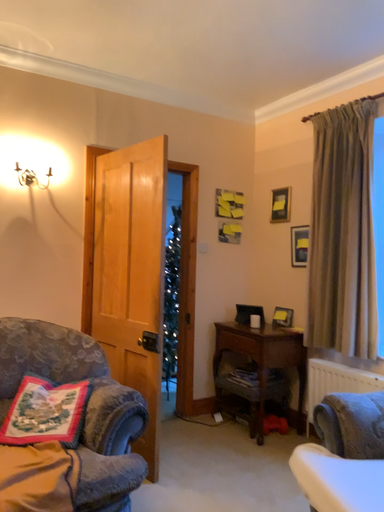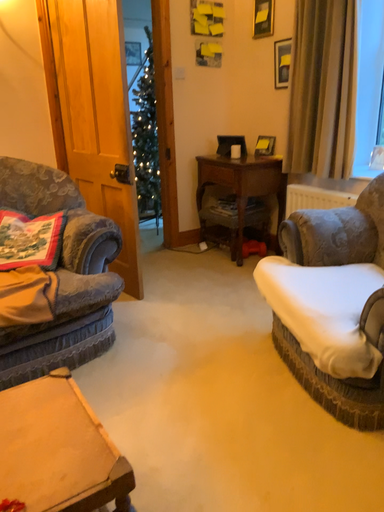
Question: How did the camera likely rotate when shooting the video?

Choices:
 (A) rotated upward
 (B) rotated downward

Answer: (B)